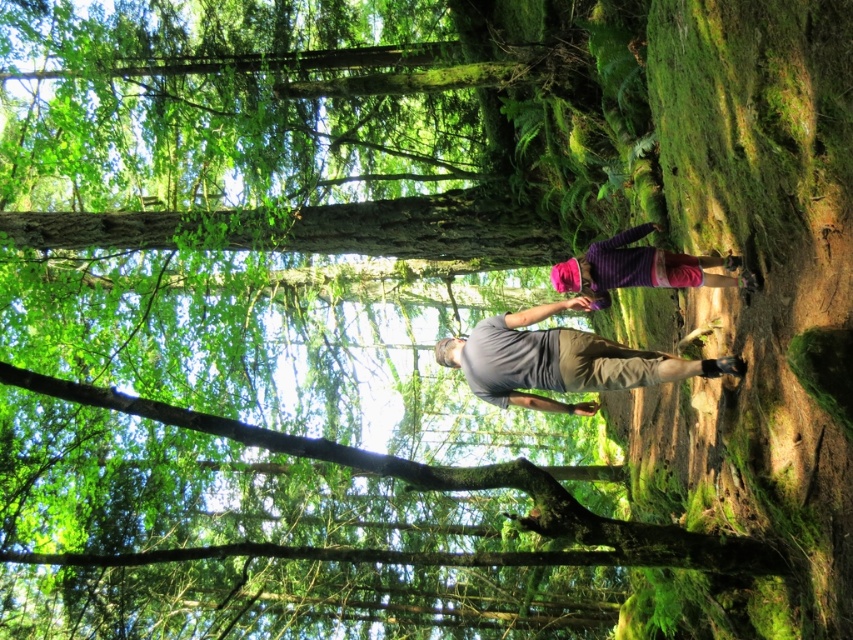
Consider the image. Does smooth brown tree trunk at center have a greater height compared to purple striped shirt at center?

Indeed, smooth brown tree trunk at center has a greater height compared to purple striped shirt at center.

Does point (235, 220) come closer to viewer compared to point (671, 253)?

No, it is behind (671, 253).

Where is `smooth brown tree trunk at center`? This screenshot has height=640, width=853. smooth brown tree trunk at center is located at coordinates (318, 228).

Is gray cotton shirt at center smaller than purple striped shirt at center?

No, gray cotton shirt at center is not smaller than purple striped shirt at center.

Between gray cotton shirt at center and purple striped shirt at center, which one has more height?

With more height is gray cotton shirt at center.

Is point (556, 403) positioned behind point (738, 260)?

Yes, it is behind point (738, 260).

Find the location of a particular element. The width and height of the screenshot is (853, 640). gray cotton shirt at center is located at coordinates (560, 360).

How distant is smooth brown tree trunk at center from gray cotton shirt at center?

smooth brown tree trunk at center and gray cotton shirt at center are 4.10 meters apart from each other.

Does point (425, 195) lie in front of point (585, 304)?

No, (425, 195) is behind (585, 304).

Where is `smooth brown tree trunk at center`? The height and width of the screenshot is (640, 853). smooth brown tree trunk at center is located at coordinates (318, 228).